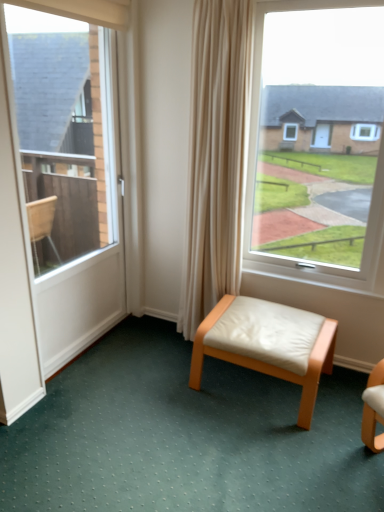
Question: Is white leather stool at center in front of or behind white leather stool at center in the image?

Choices:
 (A) front
 (B) behind

Answer: (A)

Question: Considering the positions of white leather stool at center and white leather stool at center in the image, is white leather stool at center wider or thinner than white leather stool at center?

Choices:
 (A) thin
 (B) wide

Answer: (B)

Question: Estimate the real-world distances between objects in this image. Which object is closer to the white glossy door at left?

Choices:
 (A) white leather stool at center
 (B) white leather stool at center

Answer: (A)

Question: Which object is positioned closest to the white glossy door at left?

Choices:
 (A) white leather stool at center
 (B) white leather stool at center

Answer: (A)